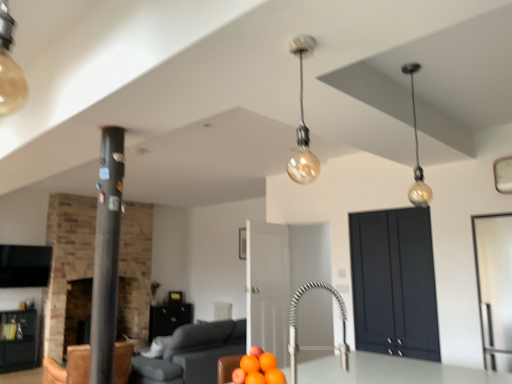
In order to click on satin nickel faucet at center in this screenshot , I will do `click(315, 346)`.

In order to face matte gray sofa at lower center, should I rotate leftwards or rightwards?

Turn left by 7.688 degrees to look at matte gray sofa at lower center.

What do you see at coordinates (67, 260) in the screenshot?
I see `brick fireplace at left, the 1th fireplace positioned from the right` at bounding box center [67, 260].

The height and width of the screenshot is (384, 512). What are the coordinates of `leather armchair at lower left` in the screenshot? It's located at (68, 367).

What is the approximate width of brick fireplace at left, which appears as the first fireplace when viewed from the left?

brick fireplace at left, which appears as the first fireplace when viewed from the left, is 41.49 centimeters in width.

What is the approximate width of translucent glass bulb at center, which appears as the first light fixture when viewed from the front?

The width of translucent glass bulb at center, which appears as the first light fixture when viewed from the front, is 4.79 inches.

At what (x,y) coordinates should I click in order to perform the action: click on satin nickel faucet at center. Please return your answer as a coordinate pair (x, y). The image size is (512, 384). Looking at the image, I should click on (315, 346).

Considering the positions of objects matte black cabinet at left, the second cabinetry from the back, and leather armchair at lower left in the image provided, who is in front, matte black cabinet at left, the second cabinetry from the back, or leather armchair at lower left?

leather armchair at lower left is more forward.

From the image's perspective, which is above, matte black cabinet at left, which is the 2th cabinetry from bottom to top, or leather armchair at lower left?

leather armchair at lower left.

Can you confirm if matte black cabinet at left, positioned as the third cabinetry in right-to-left order, is positioned to the left of leather armchair at lower left?

Yes, matte black cabinet at left, positioned as the third cabinetry in right-to-left order, is to the left of leather armchair at lower left.

How distant is dark matte cabinet at center right, which is the 1th cabinetry from front to back, from translucent glass bulb at center, which appears as the first light fixture when viewed from the front?

They are 7.64 feet apart.

Is dark matte cabinet at center right, which appears as the third cabinetry when viewed from the back, not close to translucent glass bulb at center, arranged as the 1th light fixture when viewed from the left?

Indeed, dark matte cabinet at center right, which appears as the third cabinetry when viewed from the back, is not near translucent glass bulb at center, arranged as the 1th light fixture when viewed from the left.

In the scene shown: Is dark matte cabinet at center right, which is the 1th cabinetry from front to back, shorter than translucent glass bulb at center, placed as the second light fixture when sorted from right to left?

Incorrect, the height of dark matte cabinet at center right, which is the 1th cabinetry from front to back, does not fall short of that of translucent glass bulb at center, placed as the second light fixture when sorted from right to left.

From a real-world perspective, is dark matte cabinet at center right, which appears as the 3th cabinetry when ordered from the bottom, positioned over translucent glass bulb at center, arranged as the 1th light fixture when viewed from the left, based on gravity?

No, from a real-world perspective, dark matte cabinet at center right, which appears as the 3th cabinetry when ordered from the bottom, is not over translucent glass bulb at center, arranged as the 1th light fixture when viewed from the left

Does point (308, 137) appear closer or farther from the camera than point (151, 339)?

Point (308, 137) is positioned closer to the camera compared to point (151, 339).

From a real-world perspective, which is physically above, translucent glass bulb at center, placed as the second light fixture when sorted from back to front, or matte black cabinet at lower center, acting as the first cabinetry starting from the back?

In real-world perspective, translucent glass bulb at center, placed as the second light fixture when sorted from back to front, is above.

Considering the sizes of objects translucent glass bulb at center, placed as the second light fixture when sorted from right to left, and matte black cabinet at lower center, the 2th cabinetry when ordered from right to left, in the image provided, who is smaller, translucent glass bulb at center, placed as the second light fixture when sorted from right to left, or matte black cabinet at lower center, the 2th cabinetry when ordered from right to left,?

Smaller between the two is translucent glass bulb at center, placed as the second light fixture when sorted from right to left.

Would you consider brick fireplace at left, which appears as the 2th fireplace when viewed from the left, to be distant from translucent glass bulb at center, placed as the second light fixture when sorted from back to front?

That's right, there is a large distance between brick fireplace at left, which appears as the 2th fireplace when viewed from the left, and translucent glass bulb at center, placed as the second light fixture when sorted from back to front.

Consider the image. Could you tell me if brick fireplace at left, the 1th fireplace positioned from the right, is facing translucent glass bulb at center, arranged as the 1th light fixture when viewed from the left?

Yes, brick fireplace at left, the 1th fireplace positioned from the right, is oriented towards translucent glass bulb at center, arranged as the 1th light fixture when viewed from the left.

Based on the photo, between brick fireplace at left, which appears as the 2th fireplace when viewed from the left, and translucent glass bulb at center, arranged as the 1th light fixture when viewed from the left, which one has larger size?

brick fireplace at left, which appears as the 2th fireplace when viewed from the left.

Is point (140, 245) positioned behind point (303, 132)?

Yes, it is behind point (303, 132).

From a real-world perspective, is matte glass bulb at upper right, positioned as the 2th light fixture in left-to-right order, below black matte pillar at left?

Actually, matte glass bulb at upper right, positioned as the 2th light fixture in left-to-right order, is physically above black matte pillar at left in the real world.

Which of these two, matte glass bulb at upper right, positioned as the 2th light fixture in left-to-right order, or black matte pillar at left, is bigger?

black matte pillar at left is bigger.

From the picture: Considering the positions of objects matte glass bulb at upper right, which appears as the 1th light fixture when viewed from the back, and black matte pillar at left in the image provided, who is more to the left, matte glass bulb at upper right, which appears as the 1th light fixture when viewed from the back, or black matte pillar at left?

black matte pillar at left is more to the left.

From the black matte pillar at left, count 2nd light fixture to the right and point to it. Please provide its 2D coordinates.

[(417, 153)]

Can we say black matte pillar at left lies outside matte gray sofa at lower center?

Yes, black matte pillar at left is located beyond the bounds of matte gray sofa at lower center.

How many degrees apart are the facing directions of black matte pillar at left and matte gray sofa at lower center?

The angular difference between black matte pillar at left and matte gray sofa at lower center is 92.1 degrees.

In terms of height, does black matte pillar at left look taller or shorter compared to matte gray sofa at lower center?

In the image, black matte pillar at left appears to be taller than matte gray sofa at lower center.

From the image's perspective, between black matte pillar at left and matte gray sofa at lower center, which one is located above?

black matte pillar at left.

Considering the relative sizes of orange matte at center and brick fireplace at left, which appears as the 2th fireplace when viewed from the left, in the image provided, is orange matte at center wider than brick fireplace at left, which appears as the 2th fireplace when viewed from the left,?

No, orange matte at center is not wider than brick fireplace at left, which appears as the 2th fireplace when viewed from the left.

Looking at this image, considering the positions of objects orange matte at center and brick fireplace at left, which appears as the 2th fireplace when viewed from the left, in the image provided, who is in front, orange matte at center or brick fireplace at left, which appears as the 2th fireplace when viewed from the left,?

orange matte at center.

Do you think orange matte at center is within brick fireplace at left, which appears as the 2th fireplace when viewed from the left, or outside of it?

orange matte at center is outside brick fireplace at left, which appears as the 2th fireplace when viewed from the left.

Is orange matte at center aimed at brick fireplace at left, the 1th fireplace positioned from the right?

Yes, orange matte at center faces towards brick fireplace at left, the 1th fireplace positioned from the right.

This screenshot has height=384, width=512. Find the location of `the 2nd cabinetry behind the leather armchair at lower left, starting your count from the anchor`. the 2nd cabinetry behind the leather armchair at lower left, starting your count from the anchor is located at coordinates tap(18, 340).

Find the location of `the 2nd light fixture in front when counting from the dark matte cabinet at center right, the first cabinetry positioned from the right`. the 2nd light fixture in front when counting from the dark matte cabinet at center right, the first cabinetry positioned from the right is located at coordinates (302, 122).

Based on their spatial positions, is matte gray sofa at lower center or brick fireplace at left, the 1th fireplace positioned from the right, closer to matte glass bulb at upper right, which appears as the 1th light fixture when viewed from the back?

Among the two, matte gray sofa at lower center is located nearer to matte glass bulb at upper right, which appears as the 1th light fixture when viewed from the back.

Based on their spatial positions, is matte black cabinet at left, which is the second cabinetry from front to back, or matte glass bulb at upper right, positioned as the 2th light fixture in front-to-back order, closer to satin nickel faucet at center?

Among the two, matte glass bulb at upper right, positioned as the 2th light fixture in front-to-back order, is located nearer to satin nickel faucet at center.

Looking at the image, which one is located further to translucent glass bulb at center, placed as the second light fixture when sorted from back to front, matte gray sofa at lower center or satin nickel faucet at center?

matte gray sofa at lower center lies further to translucent glass bulb at center, placed as the second light fixture when sorted from back to front, than the other object.

From the image, which object appears to be farther from matte glass bulb at upper right, positioned as the 2th light fixture in front-to-back order, brick fireplace at left, the second fireplace positioned from the right, or leather armchair at lower left?

brick fireplace at left, the second fireplace positioned from the right, is further to matte glass bulb at upper right, positioned as the 2th light fixture in front-to-back order.

Based on the photo, which object lies further to the anchor point black matte pillar at left, matte glass bulb at upper right, the first light fixture when ordered from right to left, or orange matte at center?

Based on the image, matte glass bulb at upper right, the first light fixture when ordered from right to left, appears to be further to black matte pillar at left.

Looking at the image, which one is located further to leather armchair at lower left, brick fireplace at left, which appears as the 2th fireplace when viewed from the left, or matte black cabinet at left, the second cabinetry from the back?

Based on the image, brick fireplace at left, which appears as the 2th fireplace when viewed from the left, appears to be further to leather armchair at lower left.

Which object lies nearer to the anchor point matte black cabinet at left, which is the second cabinetry from front to back, orange matte at center or matte black cabinet at lower center, acting as the first cabinetry starting from the back?

matte black cabinet at lower center, acting as the first cabinetry starting from the back.

Which object lies nearer to the anchor point brick fireplace at left, the 1th fireplace positioned from the right, dark matte cabinet at center right, which appears as the third cabinetry when viewed from the back, or satin nickel faucet at center?

dark matte cabinet at center right, which appears as the third cabinetry when viewed from the back, is positioned closer to the anchor brick fireplace at left, the 1th fireplace positioned from the right.

Identify the location of light fixture located between orange matte at center and brick fireplace at left, the second fireplace positioned from the right, in the depth direction. The image size is (512, 384). (417, 153).

Image resolution: width=512 pixels, height=384 pixels. In order to click on armchair between translucent glass bulb at center, placed as the second light fixture when sorted from right to left, and matte black cabinet at lower center, the 2th cabinetry when ordered from right to left, along the z-axis in this screenshot , I will do tap(68, 367).

This screenshot has width=512, height=384. Find the location of `citrus fruit between satin nickel faucet at center and matte black cabinet at lower center, which appears as the first cabinetry when ordered from the bottom, from front to back`. citrus fruit between satin nickel faucet at center and matte black cabinet at lower center, which appears as the first cabinetry when ordered from the bottom, from front to back is located at coordinates (258, 369).

The width and height of the screenshot is (512, 384). I want to click on cabinetry located between matte black cabinet at left, which is the second cabinetry from front to back, and dark matte cabinet at center right, the 3th cabinetry viewed from the left, in the left-right direction, so click(x=168, y=318).